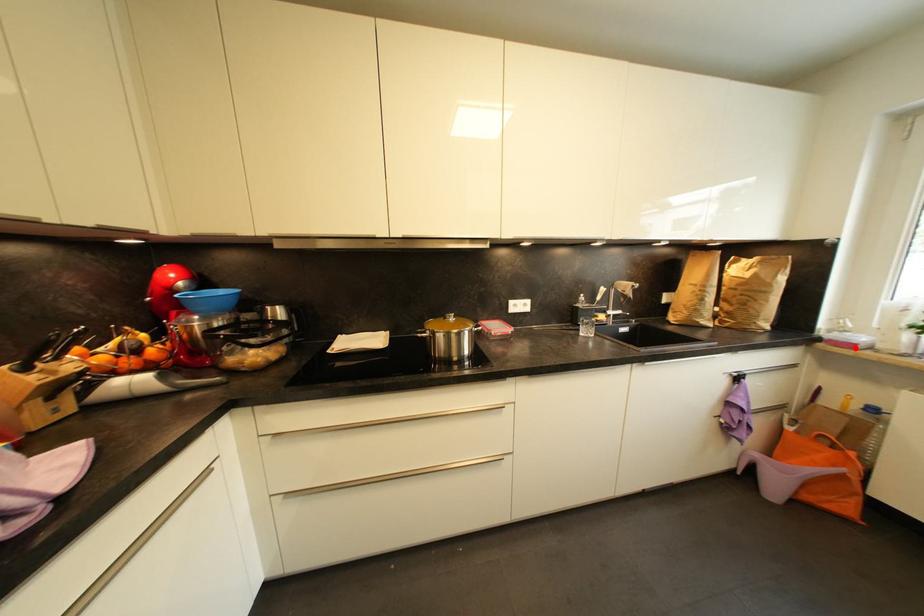
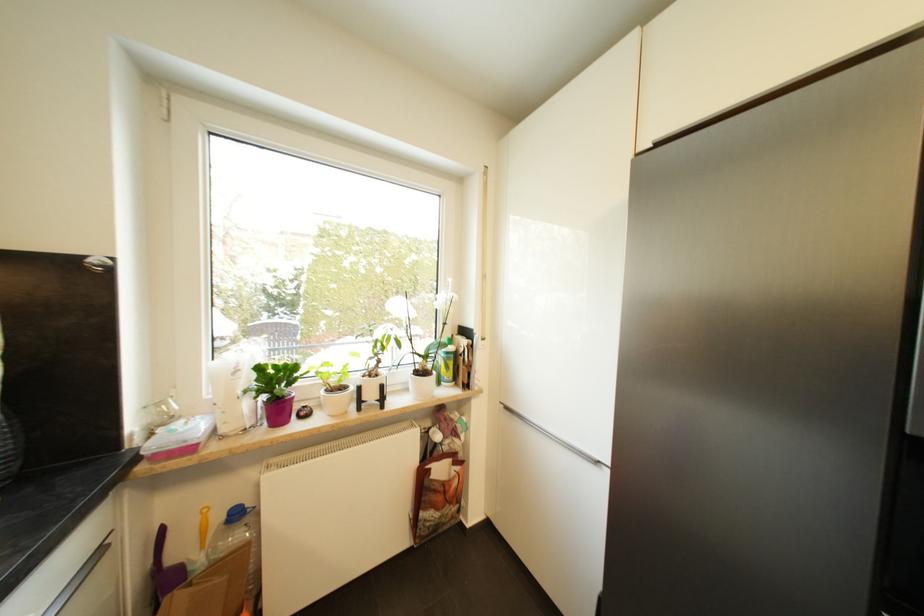
Question: I am providing you with two images of the same scene from different viewpoints. A red point is marked on the first image. Can you still see the location of the red point in image 2?

Choices:
 (A) Yes
 (B) No

Answer: (A)